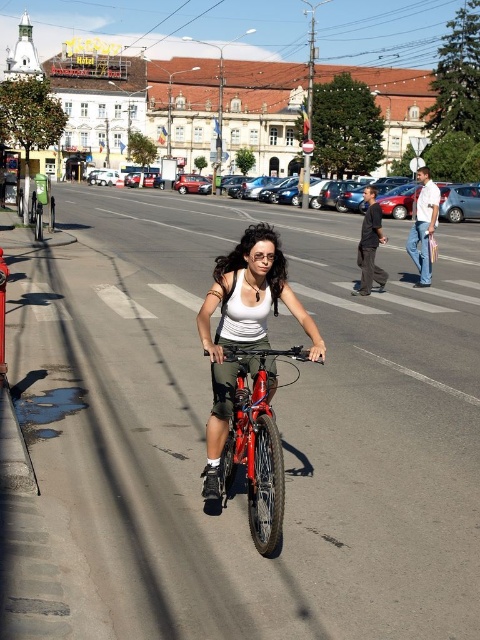
Question: Is matte white tank top at center in front of shiny metallic bicycle at center?

Choices:
 (A) yes
 (B) no

Answer: (B)

Question: Is matte white tank top at center bigger than shiny metallic bicycle at center?

Choices:
 (A) no
 (B) yes

Answer: (A)

Question: Which of the following is the closest to the observer?

Choices:
 (A) (223, 314)
 (B) (227, 486)

Answer: (B)

Question: Does matte white tank top at center have a larger size compared to shiny metallic bicycle at center?

Choices:
 (A) no
 (B) yes

Answer: (A)